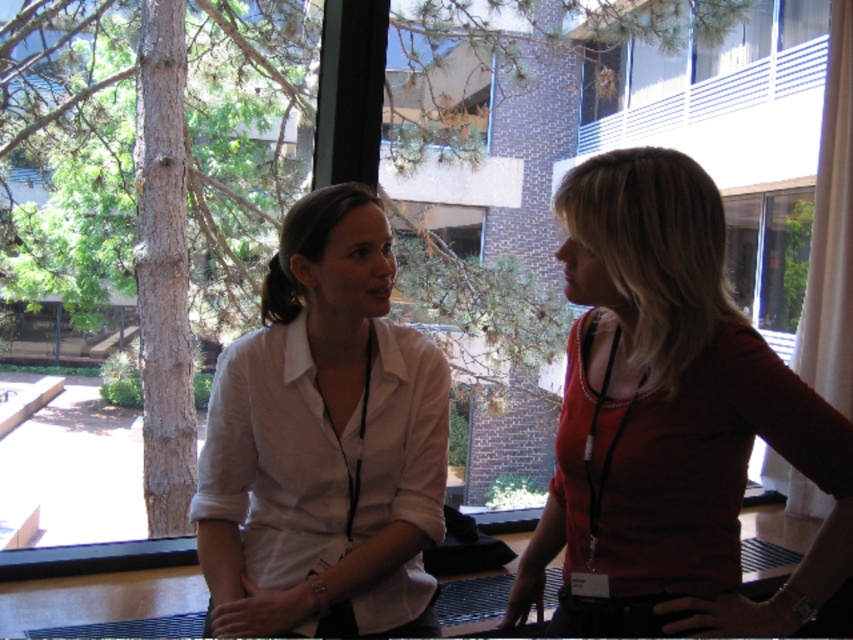
You are standing in a room with two people. You need to find the person wearing the matte red blouse at right. Which direction should you look relative to the white matte shirt at center?

The matte red blouse at right is located to the right of the white matte shirt at center, so you should look to the right side of the white matte shirt at center to find the person wearing the matte red blouse at right.

In the scene shown: You are a photographer positioned behind the two people in the scene. You want to take a photo that includes both the matte red blouse at right and the white matte shirt at center. Since you can only focus on one subject clearly, which one should you choose to ensure it appears sharp in the photo?

The matte red blouse at right is closer to the viewer than the white matte shirt at center. Therefore, to ensure sharpness, focus on the matte red blouse at right.